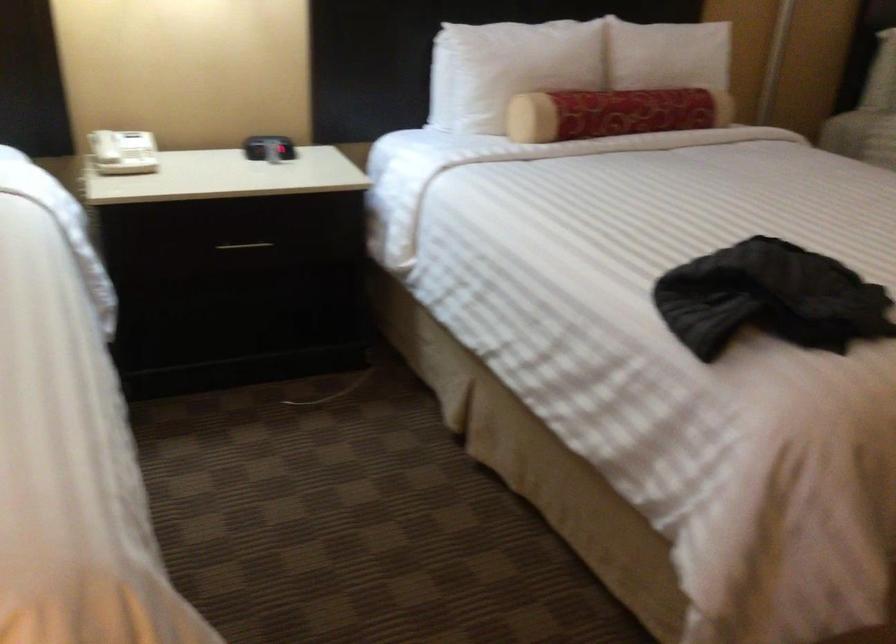
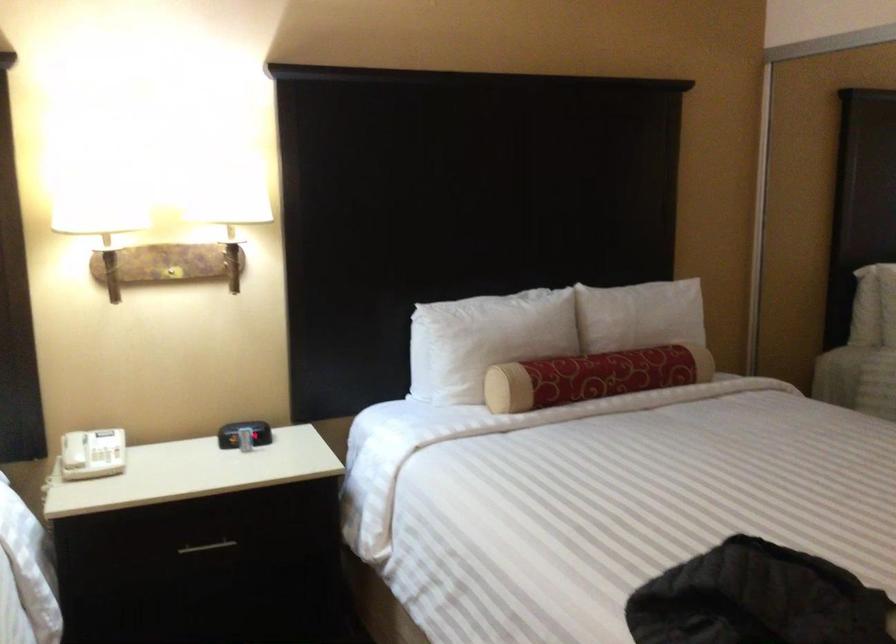
Which direction would the cameraman need to move to produce the second image?

The cameraman moved toward right, forward.